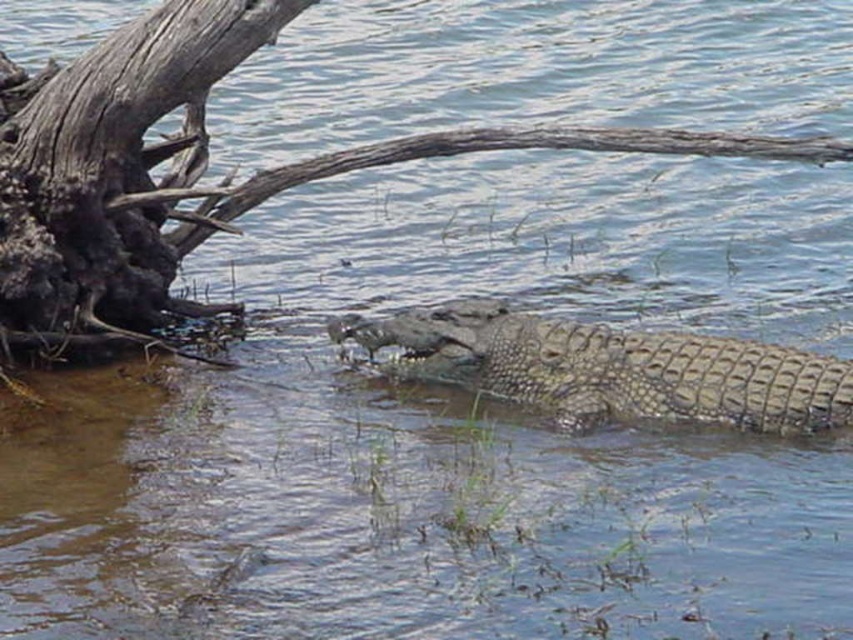
You are standing at the origin point in the image. The dark brown rough wood at left is represented by point (x=115, y=177). Can you tell me the coordinates of the dark brown rough wood at left?

The coordinates of the dark brown rough wood at left are (x=115, y=177).

You are a photographer standing at the edge of the water. You want to take a photo of the crocodile and the driftwood. The crocodile is at point (x=193, y=164) and the driftwood is at point (x=651, y=371). Which object is closer to your camera?

Point (x=193, y=164) is further to the camera than point (x=651, y=371). Therefore, the crocodile at point (x=193, y=164) is closer to the camera than the driftwood at point (x=651, y=371).

You are standing at the edge of a river and see the textured brown crocodile at center. The river has a strong current. You need to cross the river using a 20 feet long rope. Can you safely tie the rope to the crocodile to use it as an anchor?

The distance between you and the textured brown crocodile at center is 20.96 feet. The rope is only 20 feet long, so it is too short to reach the crocodile. You cannot safely tie the rope to the crocodile.